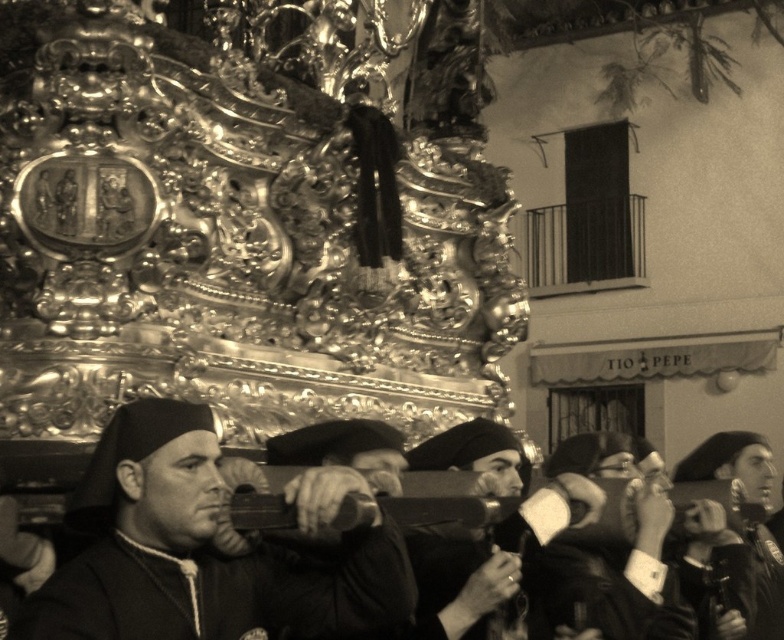
Which is in front, point (622, 589) or point (741, 467)?

Point (622, 589) is in front.

Does leather jacket at center have a lesser height compared to smooth black hat at center?

Correct, leather jacket at center is not as tall as smooth black hat at center.

Is point (626, 582) farther from viewer compared to point (750, 460)?

No, it is in front of (750, 460).

At what (x,y) coordinates should I click in order to perform the action: click on leather jacket at center. Please return your answer as a coordinate pair (x, y). Looking at the image, I should click on (605, 541).

Is point (129, 506) positioned after point (699, 474)?

No.

Where is `smooth black robe at center`? The height and width of the screenshot is (640, 784). smooth black robe at center is located at coordinates (198, 552).

Between point (318, 580) and point (771, 548), which one is positioned behind?

The point (771, 548) is behind.

Identify the location of smooth black robe at center. (198, 552).

In the scene shown: Between smooth black robe at center and leather jacket at center, which one appears on the right side from the viewer's perspective?

From the viewer's perspective, leather jacket at center appears more on the right side.

Is smooth black robe at center closer to the viewer compared to leather jacket at center?

Yes.

Does point (220, 630) lie behind point (632, 465)?

No, (220, 630) is closer to viewer.

I want to click on smooth black robe at center, so click(198, 552).